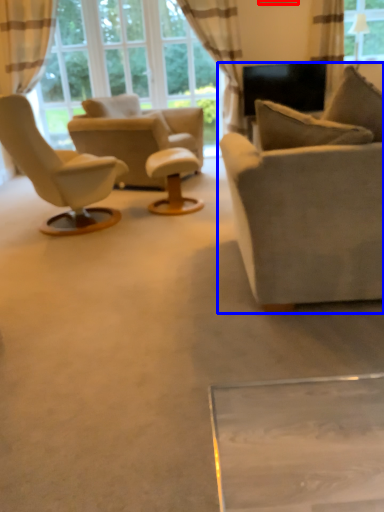
Question: Among these objects, which one is farthest to the camera, picture frame (highlighted by a red box) or studio couch (highlighted by a blue box)?

Choices:
 (A) picture frame
 (B) studio couch

Answer: (A)